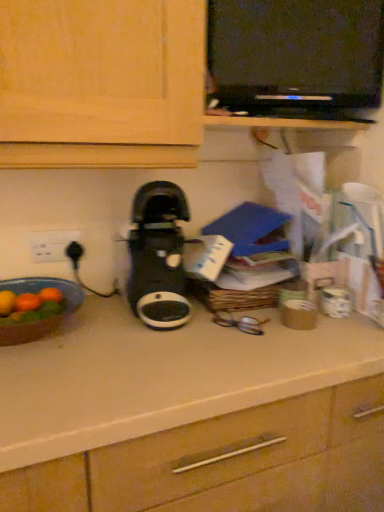
Question: From their relative heights in the image, would you say black plastic dvd player at upper center is taller or shorter than white plastic electric outlet at left?

Choices:
 (A) short
 (B) tall

Answer: (B)

Question: From the image's perspective, is black plastic dvd player at upper center above or below white plastic electric outlet at left?

Choices:
 (A) above
 (B) below

Answer: (A)

Question: Which of these objects is positioned closest to the white plastic electric outlet at left?

Choices:
 (A) matte brown bowl at left
 (B) black plastic dvd player at upper center
 (C) black plastic coffee maker at center

Answer: (A)

Question: Based on their relative distances, which object is farther from the black plastic coffee maker at center?

Choices:
 (A) black plastic dvd player at upper center
 (B) matte brown bowl at left
 (C) white plastic electric outlet at left

Answer: (A)